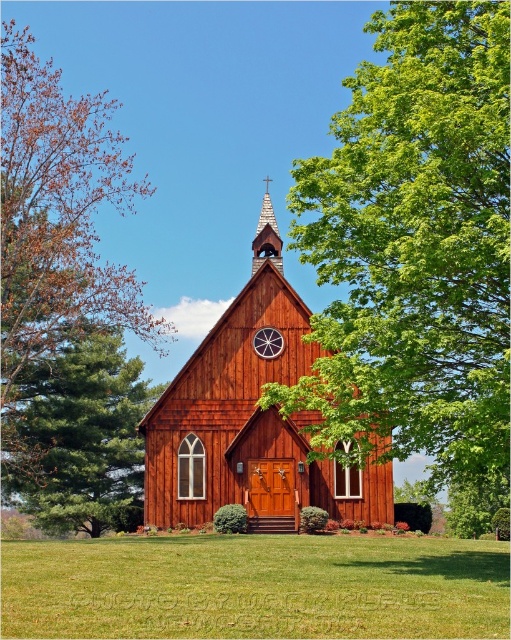
You are standing in front of the wooden church and want to take a photo of the point at coordinates point (x=98, y=166). Based on its distance from your current position, will the point be in focus if your camera has a depth of field that can sharply capture objects up to 80 meters away?

The point (x=98, y=166) is 78.21 meters from the camera. Since the depth of field can capture up to 80 meters, the point will be in focus.

You are standing in front of the wooden church and want to take a photo that includes both the green leafy tree at center and the circular window above the main entrance. Which object should you position closer to the center of your camera frame to ensure both are visible?

You should position the green leafy tree at center closer to the center of your camera frame since it is located at point (416, 252), which is closer to the center compared to the circular window above the main entrance.

You are standing in front of the wooden church and notice two points marked on the building. The first point is at coordinates point (x=505, y=161) and the second is at point (x=254, y=349). Which point is closer to your current position?

Point (x=505, y=161) is closer to the camera than point (x=254, y=349), so the first point is closer to your current position.